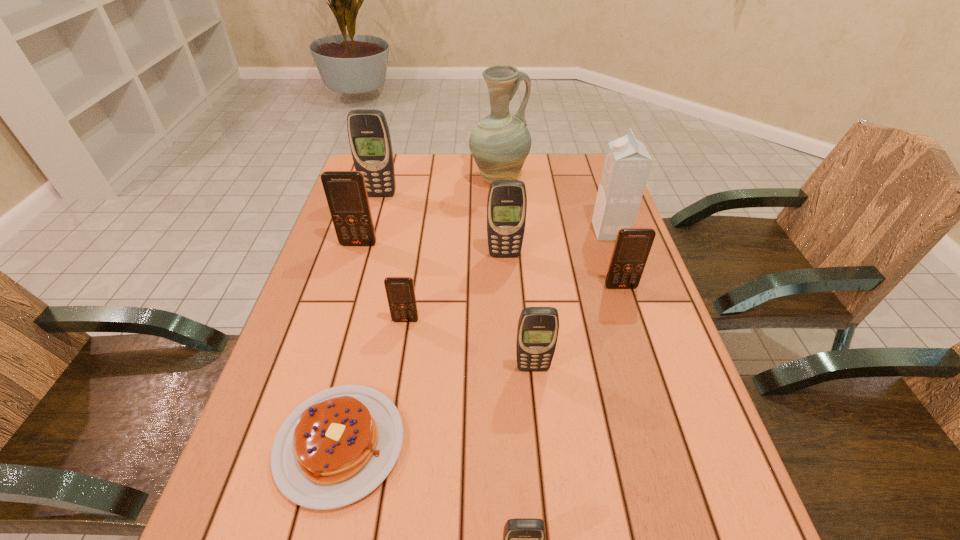
The height and width of the screenshot is (540, 960). I want to click on vacant area that lies between the fifth nearest cellular telephone and the leftmost orange cellular telephone, so click(432, 249).

The width and height of the screenshot is (960, 540). Identify the location of vacant area that lies between the sixth farthest cellular telephone and the second biggest orange cellular telephone. (577, 327).

You are a GUI agent. You are given a task and a screenshot of the screen. Output one action in this format:
    pyautogui.click(x=<x>, y=<y>)
    Task: Click on the object identified as the second closest to the pancake
    
    Given the screenshot: What is the action you would take?
    pyautogui.click(x=523, y=538)

You are a GUI agent. You are given a task and a screenshot of the screen. Output one action in this format:
    pyautogui.click(x=<x>, y=<y>)
    Task: Click on the object that is the third closest to the second nearest gray cellular telephone
    The image size is (960, 540).
    Given the screenshot: What is the action you would take?
    pyautogui.click(x=632, y=246)

Identify which cellular telephone is located as the second nearest to the third cellular telephone from left to right. Please provide its 2D coordinates. Your answer should be formatted as a tuple, i.e. [(x, y)], where the tuple contains the x and y coordinates of a point satisfying the conditions above.

[(507, 201)]

Identify which cellular telephone is the fifth nearest to the second nearest object. Please provide its 2D coordinates. Your answer should be formatted as a tuple, i.e. [(x, y)], where the tuple contains the x and y coordinates of a point satisfying the conditions above.

[(346, 194)]

Where is `gray cellular telephone that is the nearest to the sixth farthest object`? gray cellular telephone that is the nearest to the sixth farthest object is located at coordinates (507, 201).

Identify which gray cellular telephone is the second closest to the carton. Please provide its 2D coordinates. Your answer should be formatted as a tuple, i.e. [(x, y)], where the tuple contains the x and y coordinates of a point satisfying the conditions above.

[(537, 332)]

Point out which orange cellular telephone is positioned as the third nearest to the sixth nearest object. Please provide its 2D coordinates. Your answer should be formatted as a tuple, i.e. [(x, y)], where the tuple contains the x and y coordinates of a point satisfying the conditions above.

[(346, 194)]

The image size is (960, 540). I want to click on the second closest orange cellular telephone to the second orange cellular telephone from right to left, so click(632, 246).